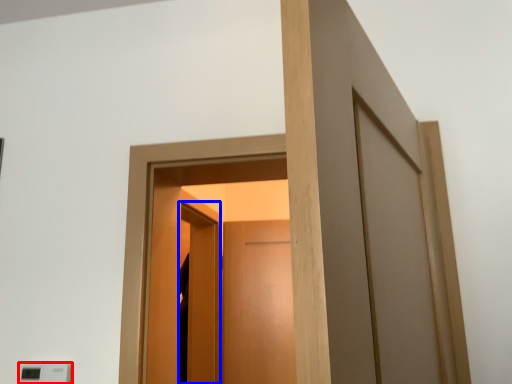
Question: Among these objects, which one is nearest to the camera, light switch (highlighted by a red box) or screen door (highlighted by a blue box)?

Choices:
 (A) light switch
 (B) screen door

Answer: (A)